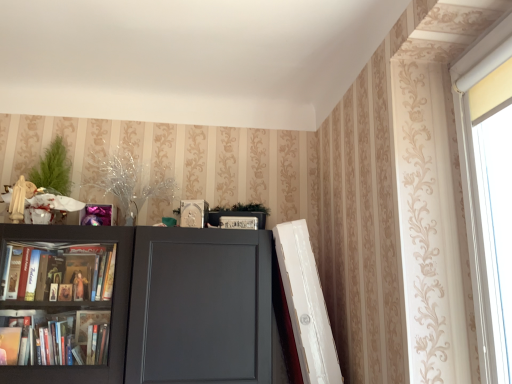
Where is `white plastic window at upper right`? white plastic window at upper right is located at coordinates 468,167.

The height and width of the screenshot is (384, 512). Describe the element at coordinates (468, 167) in the screenshot. I see `white plastic window at upper right` at that location.

Image resolution: width=512 pixels, height=384 pixels. Identify the location of white plastic window at upper right. (468, 167).